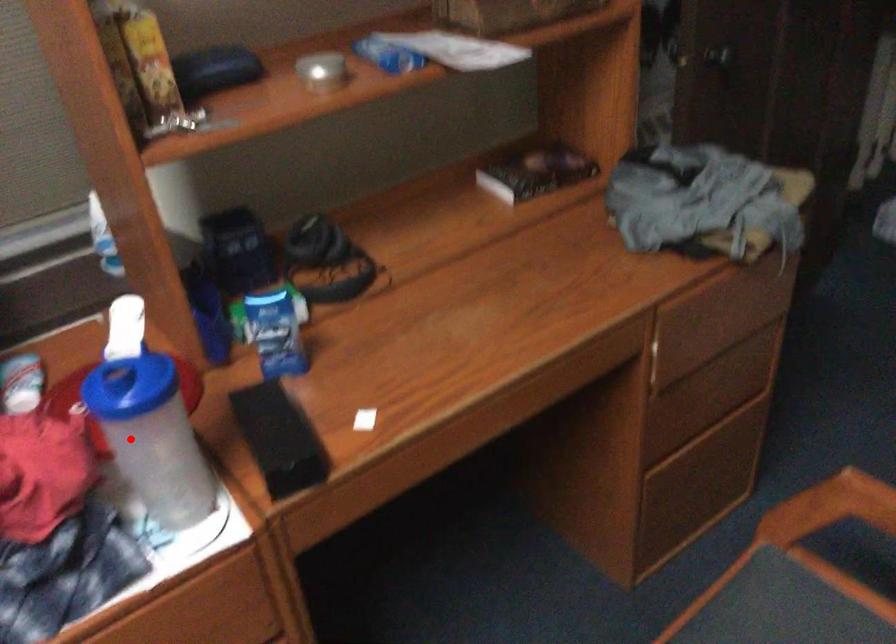
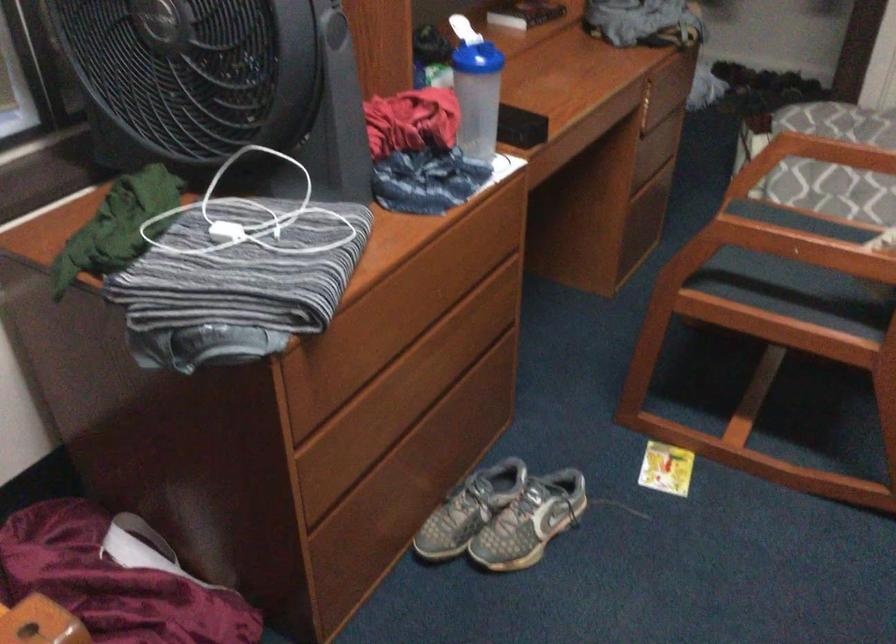
Question: I am providing you with two images of the same scene from different viewpoints. A red point is shown in image1. For the corresponding object point in image2, is it positioned nearer or farther from the camera?

Choices:
 (A) Nearer
 (B) Farther

Answer: (B)